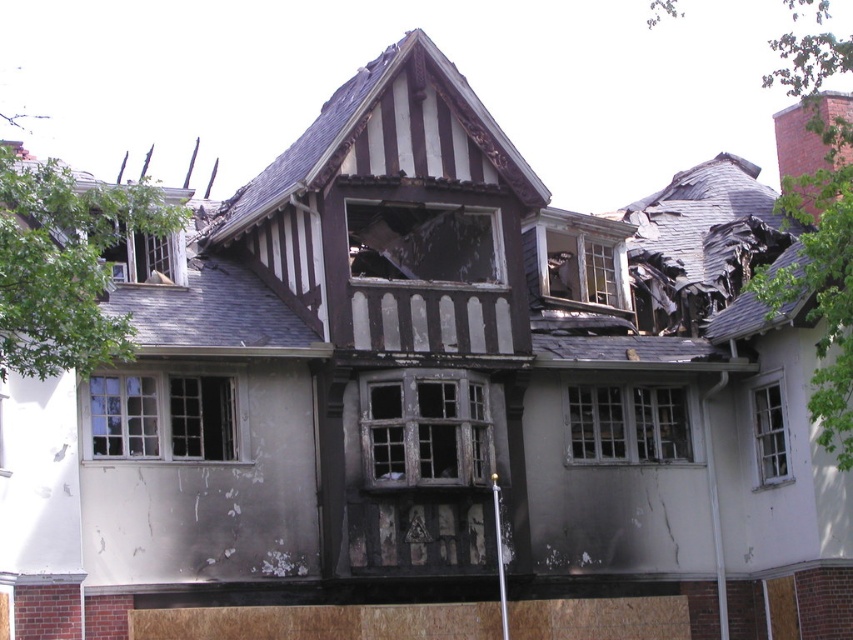
You are standing in front of the damaged house and notice two points marked on the structure. The first point is at coordinate point (570, 237) and the second is at point (149, 256). Which point is closer to you?

Point (570, 237) is further to the viewer than point (149, 256), so the second point is closer to you.

You are a firefighter assessing the damage to the house. You need to determine which window, the dark gray wooden window at center or the white wooden window at center, is bigger to prioritize which one to secure first. Which window is larger?

The dark gray wooden window at center has a larger size compared to the white wooden window at center, so it should be prioritized for securing first.